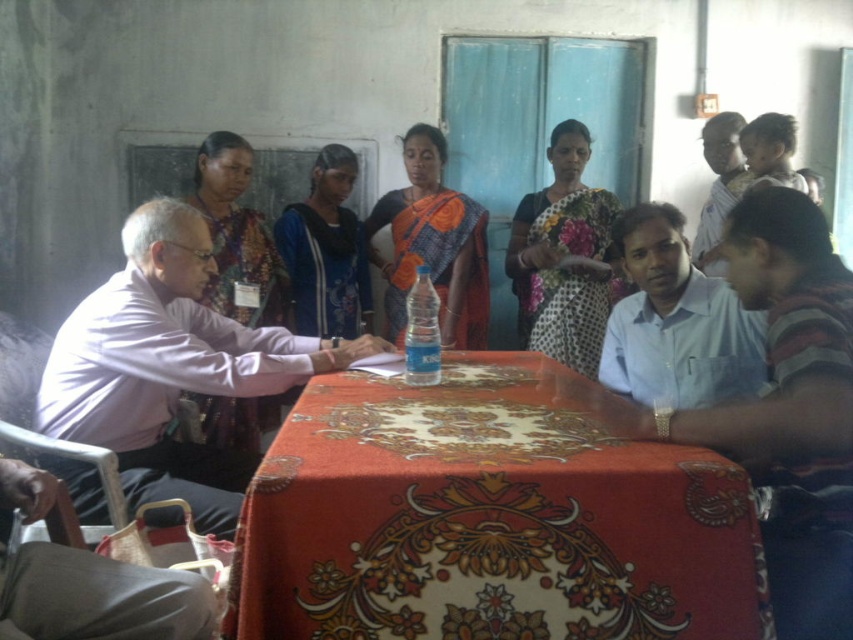
Question: Can you confirm if purple shirt at left is positioned below printed fabric saree at center?

Choices:
 (A) yes
 (B) no

Answer: (A)

Question: Does floral-patterned fabric at center lie in front of smooth skin man at upper right?

Choices:
 (A) yes
 (B) no

Answer: (A)

Question: Considering the real-world distances, which object is closest to the light blue shirt at center?

Choices:
 (A) floral fabric saree at center
 (B) printed fabric saree at center
 (C) smooth skin baby at upper right

Answer: (A)

Question: Where is light blue shirt at center located in relation to blue sari at center in the image?

Choices:
 (A) above
 (B) below

Answer: (B)

Question: Considering the real-world distances, which object is farthest from the smooth skin man at upper right?

Choices:
 (A) blue sari at center
 (B) light blue shirt at center
 (C) smooth skin baby at upper right

Answer: (B)

Question: Which point is closer to the camera taking this photo?

Choices:
 (A) (468, 477)
 (B) (717, 285)
 (C) (247, 412)
 (D) (407, 253)

Answer: (A)